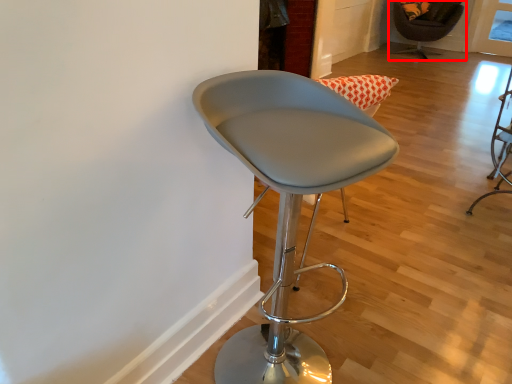
Question: Observing the image, what is the correct spatial positioning of chair (annotated by the red box) in reference to chair?

Choices:
 (A) right
 (B) left

Answer: (A)